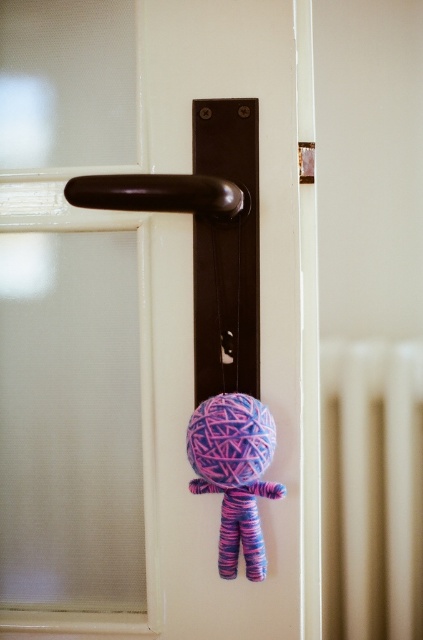
Question: Considering the relative positions of knitted yarn doll at center and brown polished metal door handle at center in the image provided, where is knitted yarn doll at center located with respect to brown polished metal door handle at center?

Choices:
 (A) left
 (B) right

Answer: (B)

Question: Which point is farther to the camera?

Choices:
 (A) matte brown handle at center
 (B) beige matte radiator at right
 (C) knitted yarn doll at center
 (D) brown polished metal door handle at center

Answer: (B)

Question: Is knitted yarn doll at center wider than brown polished metal door handle at center?

Choices:
 (A) yes
 (B) no

Answer: (B)

Question: Considering the relative positions of matte brown handle at center and knitted yarn doll at center in the image provided, where is matte brown handle at center located with respect to knitted yarn doll at center?

Choices:
 (A) left
 (B) right

Answer: (A)

Question: Which is nearer to the matte brown handle at center?

Choices:
 (A) beige matte radiator at right
 (B) knitted yarn doll at center
 (C) brown polished metal door handle at center

Answer: (B)

Question: Considering the real-world distances, which object is farthest from the brown polished metal door handle at center?

Choices:
 (A) beige matte radiator at right
 (B) matte brown handle at center
 (C) knitted yarn doll at center

Answer: (A)